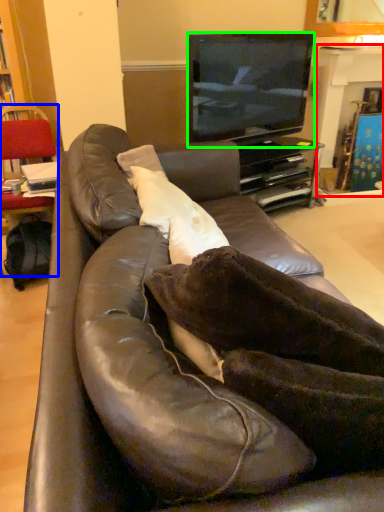
Question: Which is nearer to the fireplace (highlighted by a red box)? chair (highlighted by a blue box) or television (highlighted by a green box).

Choices:
 (A) chair
 (B) television

Answer: (B)